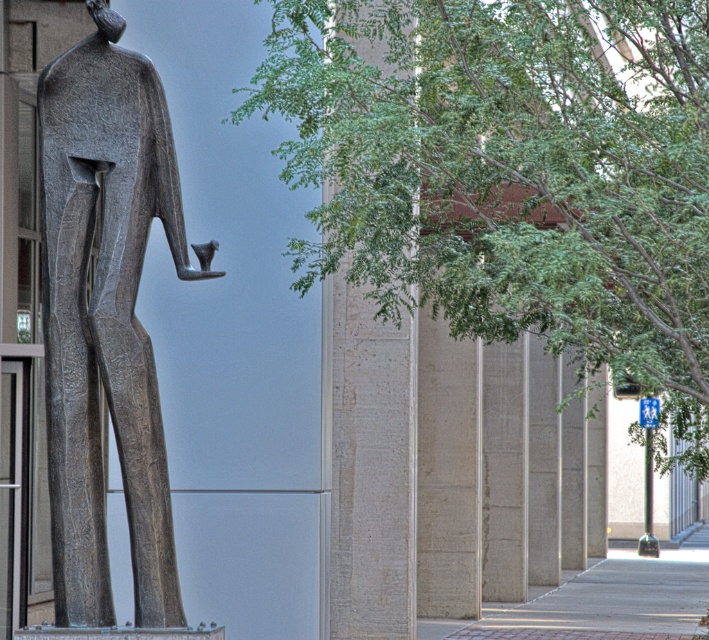
Is green leafy tree at center taller than smooth concrete pillar at center?

Yes, green leafy tree at center is taller than smooth concrete pillar at center.

Between point (558, 310) and point (325, 406), which one is positioned behind?

Point (325, 406)

Identify the location of green leafy tree at center. (510, 172).

This screenshot has width=709, height=640. Describe the element at coordinates (106, 317) in the screenshot. I see `bronze statue at left` at that location.

Based on the photo, between bronze statue at left and smooth concrete pillar at center, which one is positioned lower?

smooth concrete pillar at center

Is point (55, 516) more distant than point (381, 433)?

No, (55, 516) is closer to viewer.

Where is `bronze statue at left`? The image size is (709, 640). bronze statue at left is located at coordinates (106, 317).

Is green leafy tree at center closer to the viewer compared to bronze statue at left?

Yes, it is.

This screenshot has width=709, height=640. What do you see at coordinates (510, 172) in the screenshot?
I see `green leafy tree at center` at bounding box center [510, 172].

Locate an element on the screen. The width and height of the screenshot is (709, 640). green leafy tree at center is located at coordinates click(x=510, y=172).